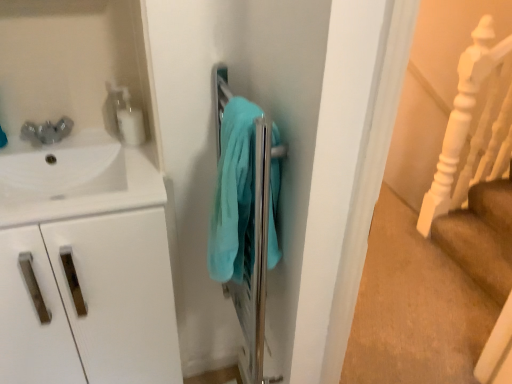
Question: In terms of width, does white glossy sink at upper left look wider or thinner when compared to white glossy soap dispenser at upper left?

Choices:
 (A) wide
 (B) thin

Answer: (A)

Question: Considering the positions of white glossy sink at upper left and white glossy soap dispenser at upper left in the image, is white glossy sink at upper left bigger or smaller than white glossy soap dispenser at upper left?

Choices:
 (A) big
 (B) small

Answer: (A)

Question: Which is farther from the white glossy soap dispenser at upper left?

Choices:
 (A) white matte cabinet at left
 (B) teal soft towel at center
 (C) white wooden stair rail at right
 (D) white glossy sink at upper left

Answer: (C)

Question: Which is farther from the white glossy soap dispenser at upper left?

Choices:
 (A) white glossy sink at upper left
 (B) white matte cabinet at left
 (C) teal soft towel at center
 (D) white wooden stair rail at right

Answer: (D)